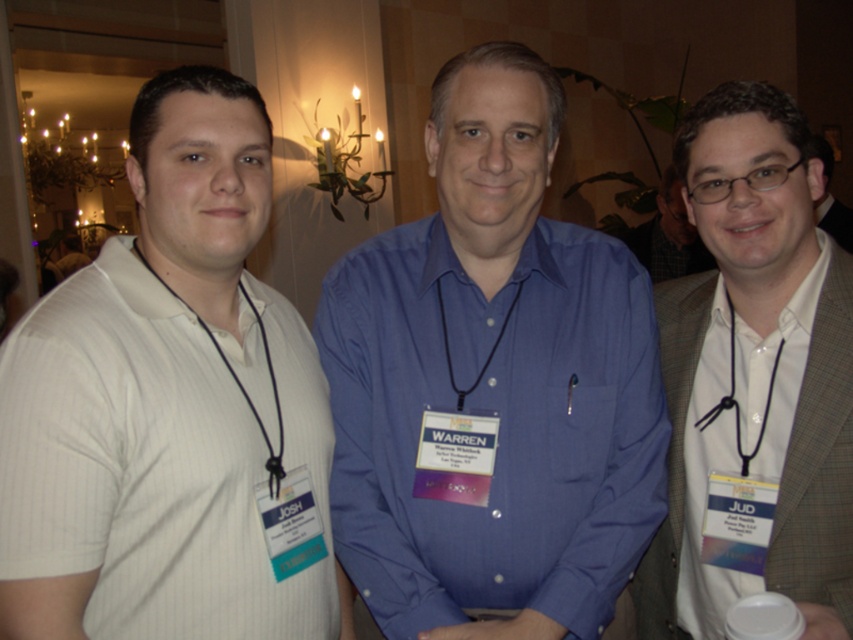
Based on the scene description, where is the gray checkered suit at right located in the image?

The gray checkered suit at right is located at point 0.584 on the horizontal axis and 0.885 on the vertical axis.

You are a photographer adjusting the focus on your camera. You need to ensure that the matte black glasses at center are in sharp focus. Given that the camera can only focus precisely on objects within a 0.1 unit radius around the point you select, which coordinates should you choose to ensure the glasses are in focus?

You should select the coordinates at point (830,196) to ensure the matte black glasses at center are in focus, as they are located exactly at that point.

Based on the scene description, if you were to place a small decorative item on the floor between the gray checkered suit at right and the black cord stethoscope at center, where would it be closer to?

The small decorative item placed on the floor between the gray checkered suit at right and the black cord stethoscope at center would be closer to the black cord stethoscope at center since the gray checkered suit at right is taller than it.